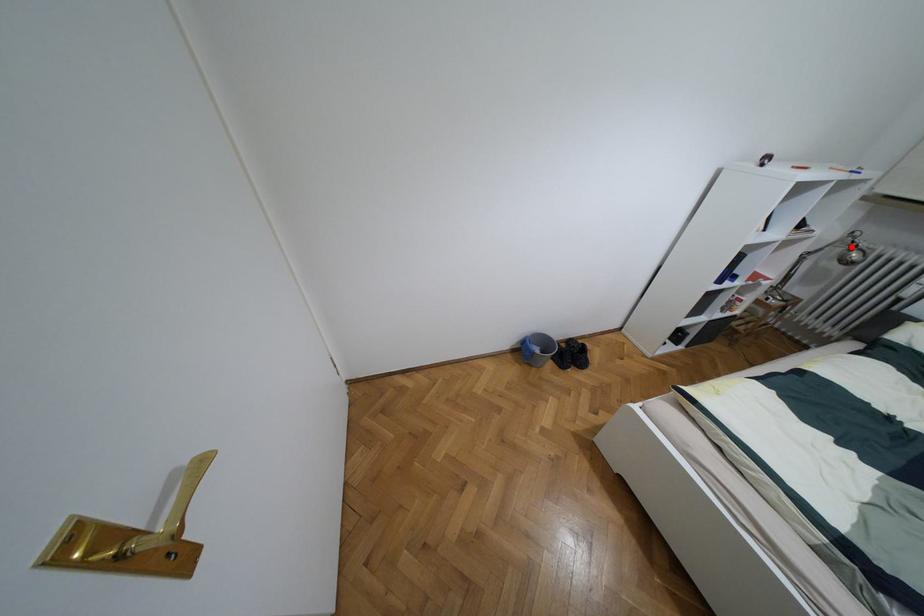
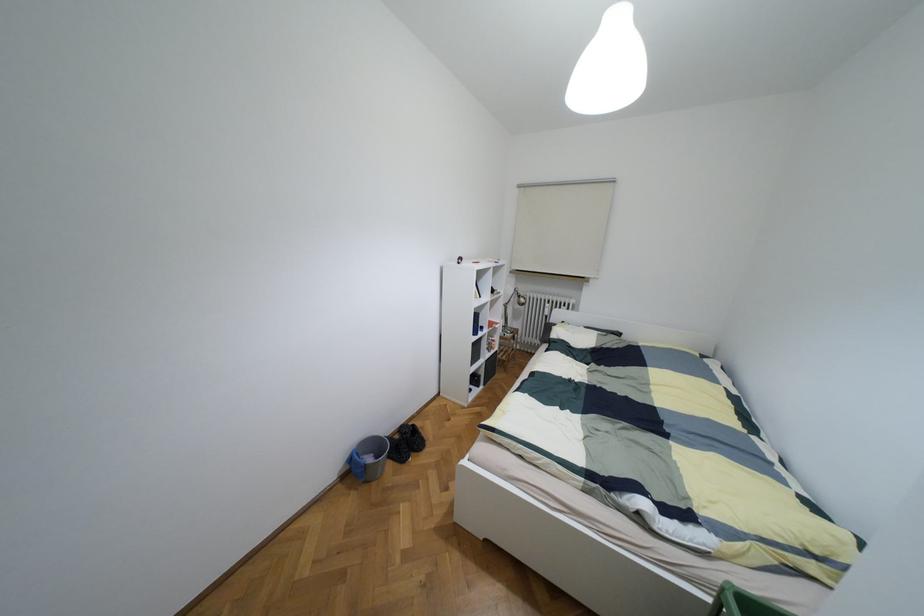
The point at the highlighted location is marked in the first image. Where is the corresponding point in the second image?

(517, 296)